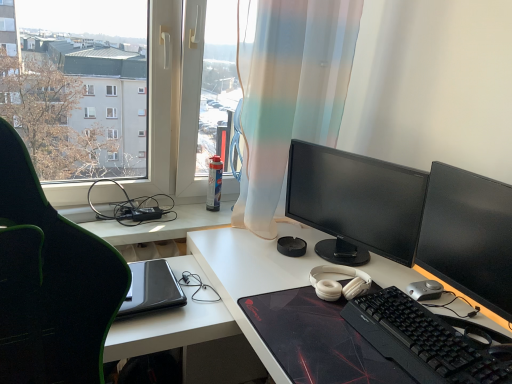
The width and height of the screenshot is (512, 384). I want to click on free space to the back side of silver metallic mouse at lower right, so click(x=406, y=273).